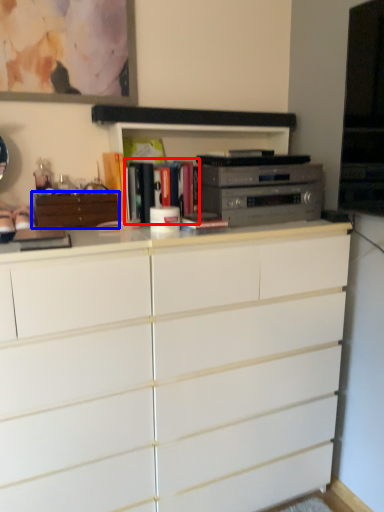
Question: Which point is further to the camera, book (highlighted by a red box) or cabinetry (highlighted by a blue box)?

Choices:
 (A) book
 (B) cabinetry

Answer: (A)